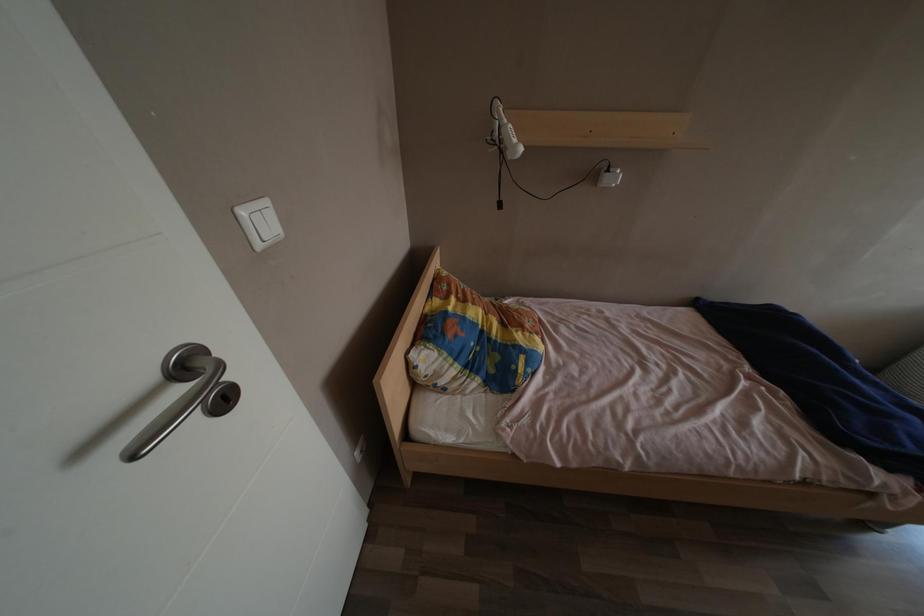
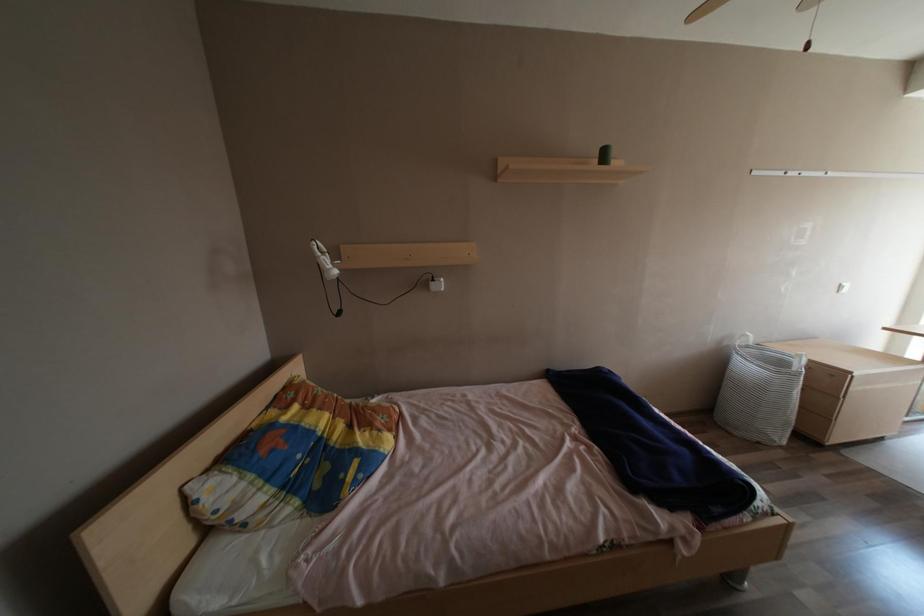
Question: How did the camera likely rotate?

Choices:
 (A) Left
 (B) Right
 (C) Up
 (D) Down

Answer: (C)